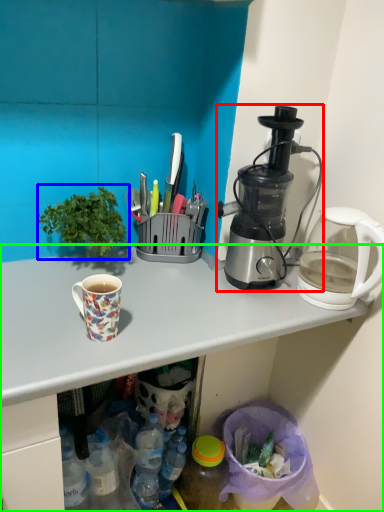
Question: Based on their relative distances, which object is nearer to blender (highlighted by a red box)? Choose from houseplant (highlighted by a blue box) and desk (highlighted by a green box).

Choices:
 (A) houseplant
 (B) desk

Answer: (B)